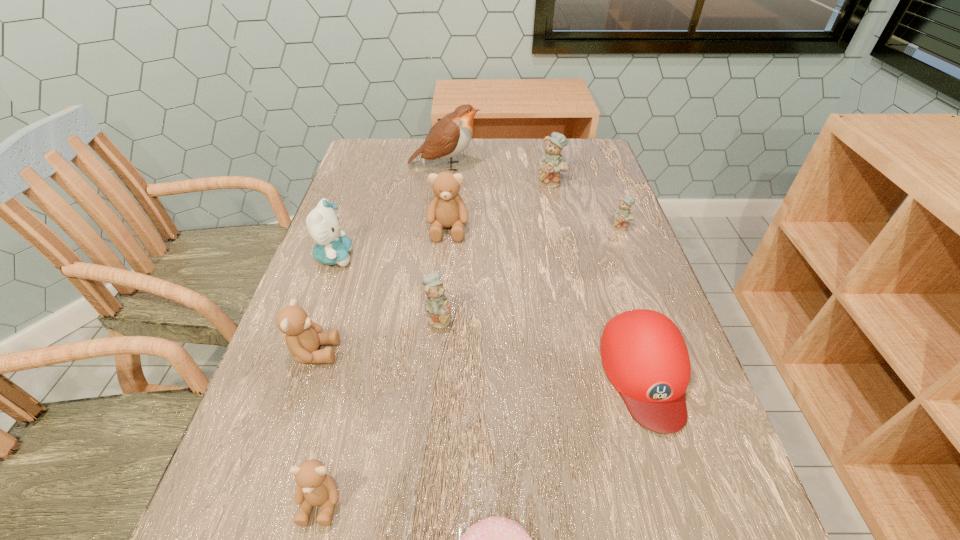
Locate an element on the screen. brown bird is located at coordinates (450, 136).

The width and height of the screenshot is (960, 540). What are the coordinates of `the tallest object` in the screenshot? It's located at (450, 136).

The image size is (960, 540). In order to click on the second blue teddy bear from right to left in this screenshot , I will do `click(552, 162)`.

At what (x,y) coordinates should I click in order to perform the action: click on the fifth teddy bear from left to right. Please return your answer as a coordinate pair (x, y). The image size is (960, 540). Looking at the image, I should click on (552, 162).

Image resolution: width=960 pixels, height=540 pixels. What are the coordinates of `the rightmost brown teddy bear` in the screenshot? It's located at pyautogui.click(x=447, y=209).

You are a GUI agent. You are given a task and a screenshot of the screen. Output one action in this format:
    pyautogui.click(x=<x>, y=<y>)
    Task: Click on the biggest brown teddy bear
    This screenshot has height=540, width=960.
    Given the screenshot: What is the action you would take?
    pyautogui.click(x=447, y=209)

The height and width of the screenshot is (540, 960). I want to click on kitten, so click(323, 225).

The width and height of the screenshot is (960, 540). In order to click on the third nearest teddy bear in this screenshot , I will do `click(437, 305)`.

At what (x,y) coordinates should I click in order to perform the action: click on the second smallest blue teddy bear. Please return your answer as a coordinate pair (x, y). The image size is (960, 540). Looking at the image, I should click on (437, 305).

Locate an element on the screen. the second nearest brown teddy bear is located at coordinates (303, 337).